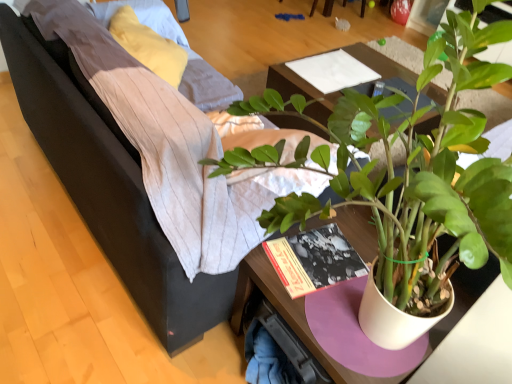
The image size is (512, 384). What are the coordinates of `vacant region above wooden table at center (from a real-world perspective)` in the screenshot? It's located at (350, 69).